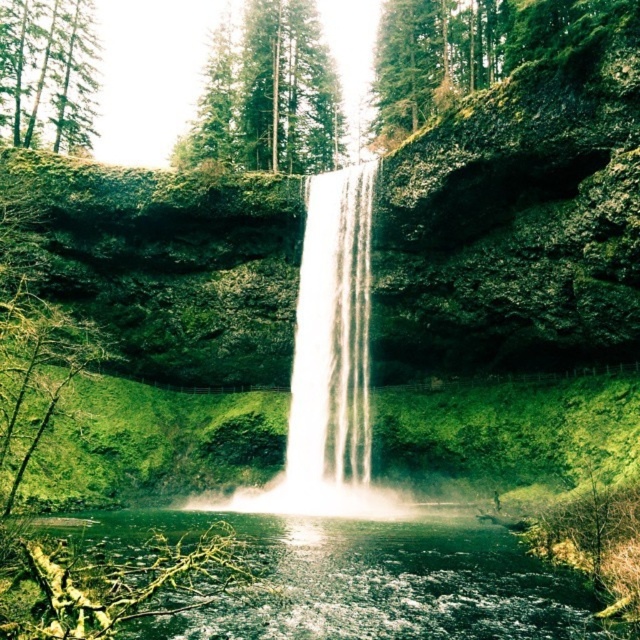
You are a hiker standing at the edge of the forest looking at the scene. You notice the clear water at center and the green matte tree at upper left. Which object is closer to you?

The clear water at center is closer to you because it is in front of the green matte tree at upper left.

You are a hiker standing at the base of the waterfall. You notice a white translucent water at center and a green textured tree at upper center. Which object is located higher up in the scene?

The green textured tree at upper center is located higher up in the scene because it is positioned above the white translucent water at center.

Looking at this image, you are standing at the base of the waterfall in the image. Looking up, you notice a specific point marked at coordinates point (266, 93). What object is located at that point?

The point (266, 93) marks a green textured tree at upper center.